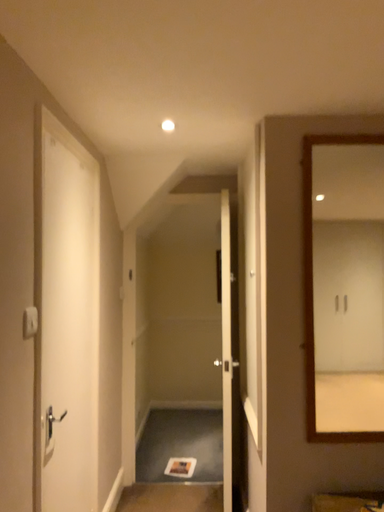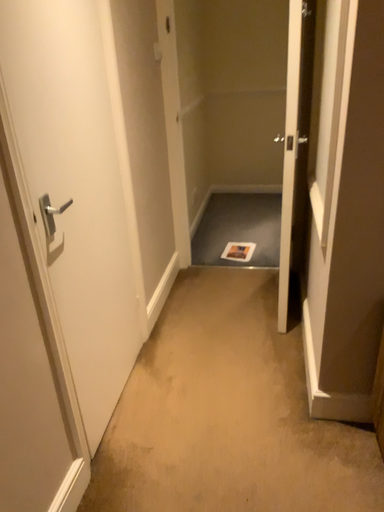
Question: How did the camera likely rotate when shooting the video?

Choices:
 (A) rotated left
 (B) rotated right

Answer: (A)